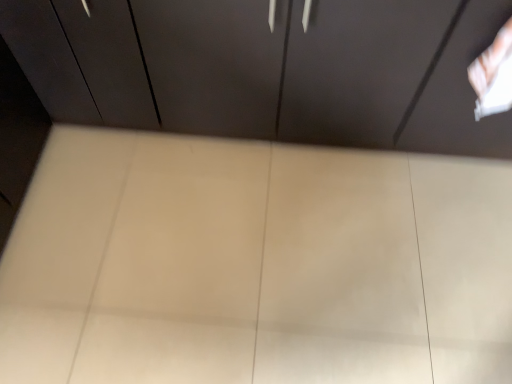
Question: Is matte dark wood cupboard at center to the left of white glossy plywood at center from the viewer's perspective?

Choices:
 (A) no
 (B) yes

Answer: (A)

Question: From the image's perspective, is matte dark wood cupboard at center under white glossy plywood at center?

Choices:
 (A) no
 (B) yes

Answer: (A)

Question: Is matte dark wood cupboard at center wider than white glossy plywood at center?

Choices:
 (A) yes
 (B) no

Answer: (B)

Question: Is white glossy plywood at center a part of matte dark wood cupboard at center?

Choices:
 (A) yes
 (B) no

Answer: (B)

Question: Is the depth of matte dark wood cupboard at center less than that of white glossy plywood at center?

Choices:
 (A) no
 (B) yes

Answer: (B)

Question: Is the position of matte dark wood cupboard at center more distant than that of white glossy plywood at center?

Choices:
 (A) yes
 (B) no

Answer: (B)

Question: Is white glossy plywood at center looking in the opposite direction of matte dark wood cupboard at center?

Choices:
 (A) no
 (B) yes

Answer: (A)

Question: Considering the relative sizes of white glossy plywood at center and matte dark wood cupboard at center in the image provided, is white glossy plywood at center wider than matte dark wood cupboard at center?

Choices:
 (A) yes
 (B) no

Answer: (A)

Question: Considering the relative sizes of white glossy plywood at center and matte dark wood cupboard at center in the image provided, is white glossy plywood at center smaller than matte dark wood cupboard at center?

Choices:
 (A) yes
 (B) no

Answer: (A)

Question: Would you say matte dark wood cupboard at center is part of white glossy plywood at center's contents?

Choices:
 (A) yes
 (B) no

Answer: (B)

Question: Is white glossy plywood at center shorter than matte dark wood cupboard at center?

Choices:
 (A) no
 (B) yes

Answer: (B)

Question: Is there a large distance between white glossy plywood at center and matte dark wood cupboard at center?

Choices:
 (A) no
 (B) yes

Answer: (A)

Question: Considering their positions, is matte dark wood cupboard at center located in front of or behind white glossy plywood at center?

Choices:
 (A) behind
 (B) front

Answer: (B)